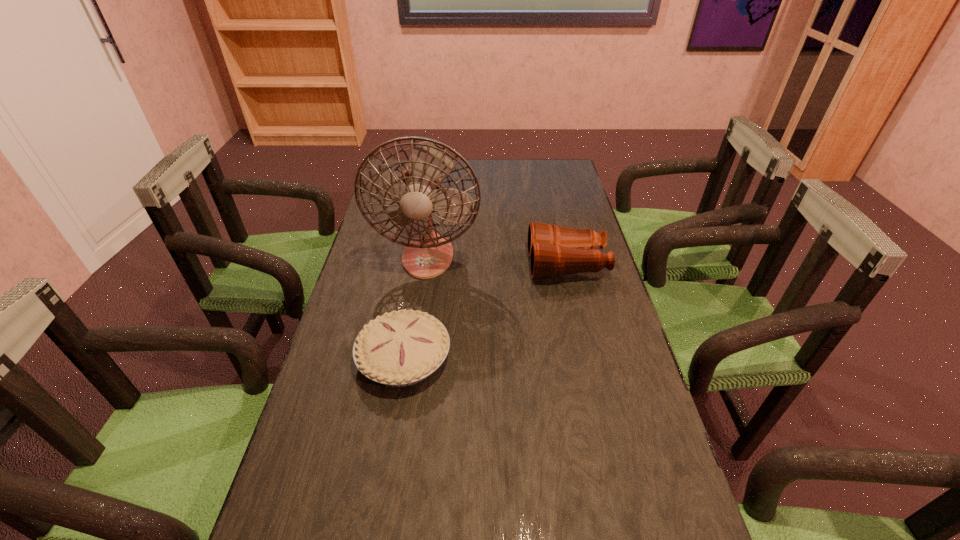
The height and width of the screenshot is (540, 960). In order to click on vacant region between the tallest object and the shortest object in this screenshot , I will do `click(416, 307)`.

Where is `empty space between the rightmost object and the fan`? This screenshot has width=960, height=540. empty space between the rightmost object and the fan is located at coordinates (497, 260).

Where is `free space between the fan and the rightmost object`? free space between the fan and the rightmost object is located at coordinates (497, 260).

Locate an element on the screen. This screenshot has height=540, width=960. vacant space that is in between the fan and the rightmost object is located at coordinates (497, 260).

Locate an element on the screen. This screenshot has width=960, height=540. empty location between the rightmost object and the tallest object is located at coordinates (497, 260).

This screenshot has width=960, height=540. What are the coordinates of `free space between the fan and the shortest object` in the screenshot? It's located at (416, 307).

I want to click on object that ranks as the second closest to the tallest object, so click(x=400, y=348).

Where is `object that is the second closest to the tallest object`? object that is the second closest to the tallest object is located at coordinates (400, 348).